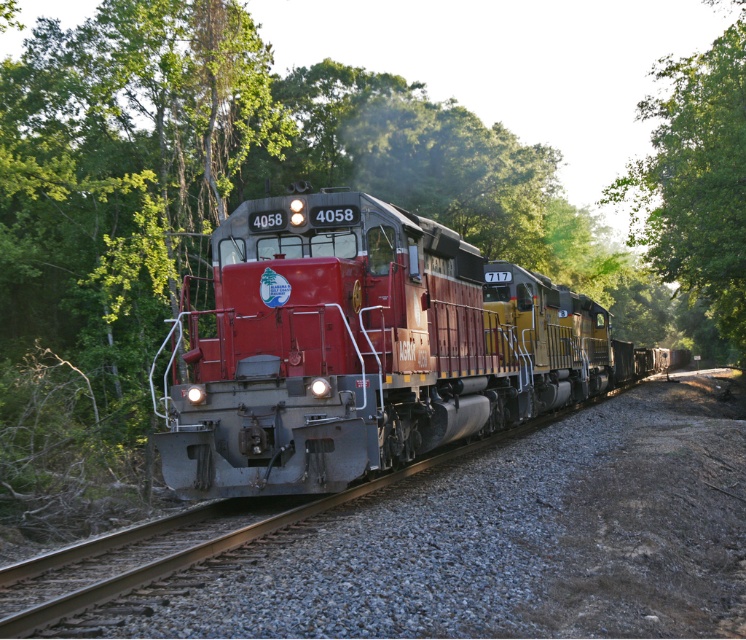
You are standing on the platform waiting for the train to pass. There is a specific point at coordinates point (x=172, y=461) that you need to reach on the other side of the tracks. Considering the train is currently 30.59 feet away from you at that point, can you safely cross the tracks to reach it before the train arrives?

The point (x=172, y=461) is 30.59 feet away from you. To determine safety, you need to calculate if the train will reach that point before you can cross. However, without knowing the train speed or your crossing time, it is impossible to confirm safety. Please check with a conductor or wait for the all clear signal.

You are standing at the edge of the forest watching the matte red train at center. If you want to estimate its position relative to your viewpoint, what are the coordinates of the train in the image?

The matte red train at center is located at point (366, 348).

You are standing at the back of the train and looking forward through the window. There are two points marked on the window. One is at coordinate point (518, 316) and the other is at point (700, 300). Which point is closer to you?

Point (518, 316) is closer to you because it is closer to the camera than point (700, 300).